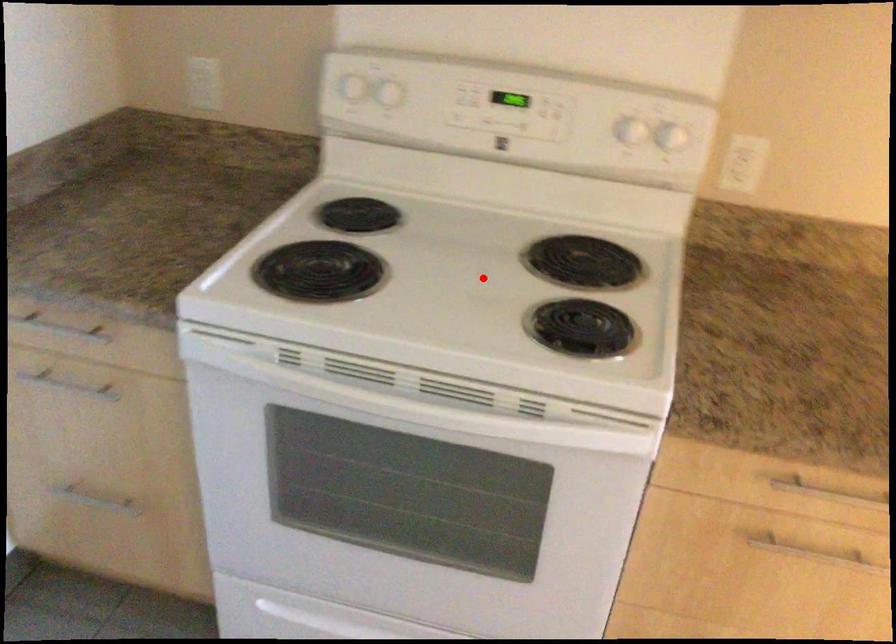
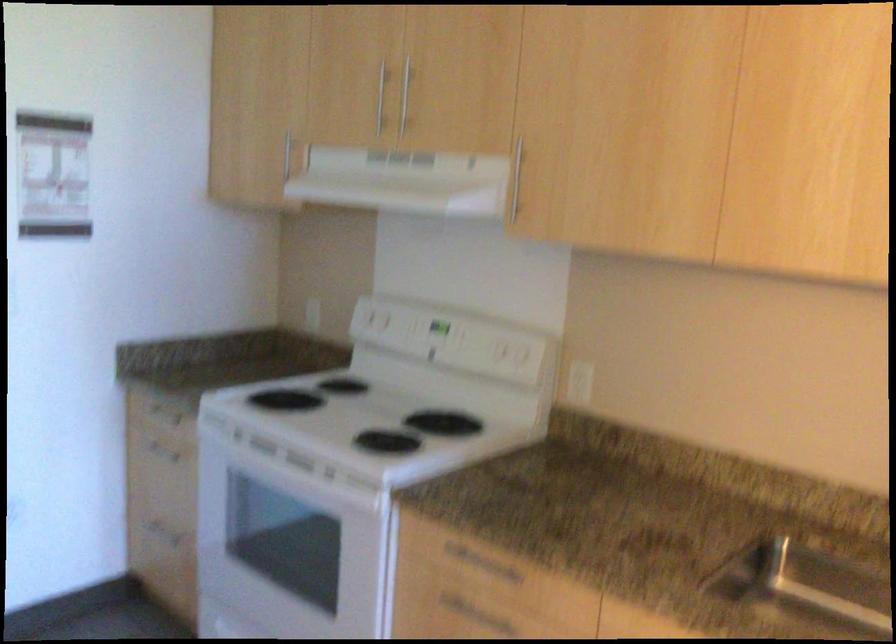
Find the pixel in the second image that matches the highlighted location in the first image.

(367, 415)